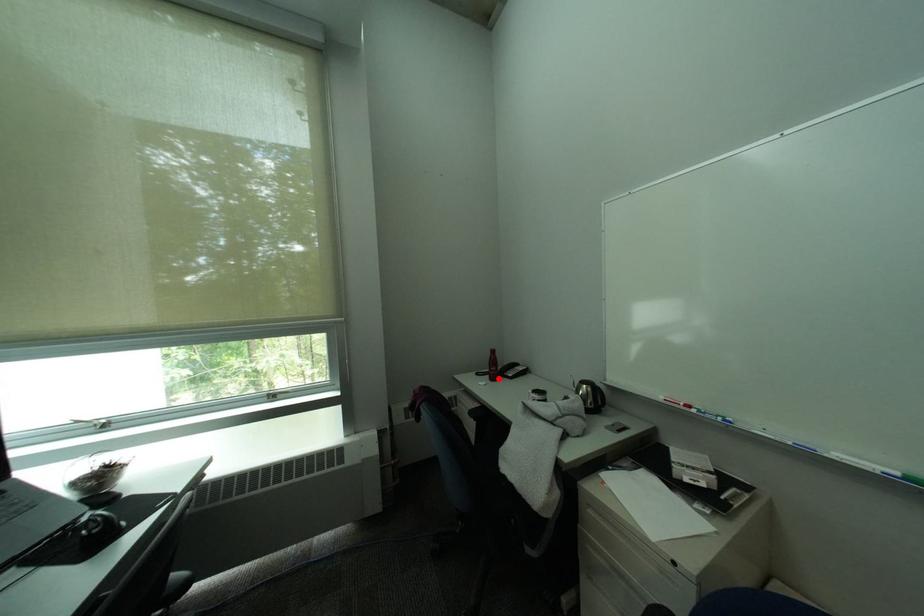
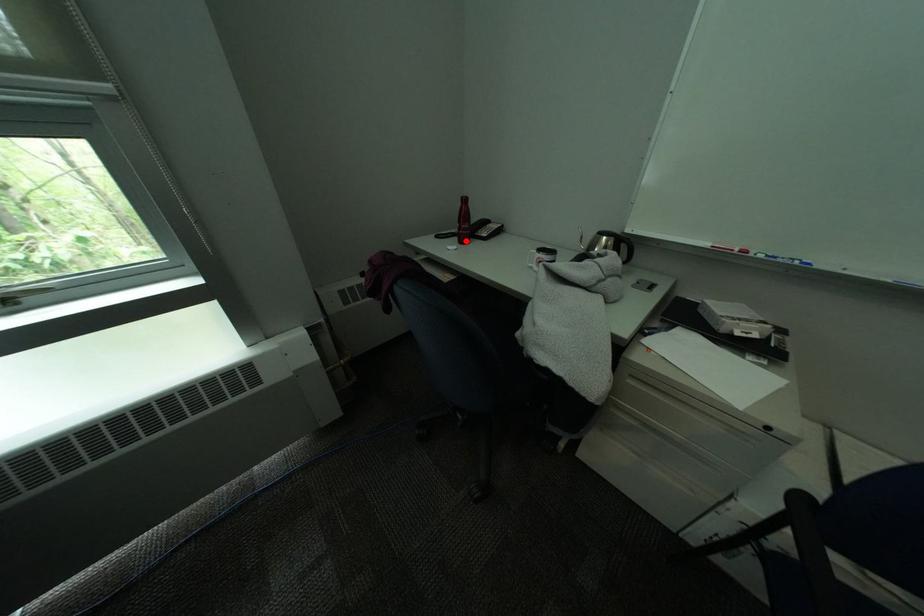
I am providing you with two images of the same scene from different viewpoints. A red point is marked on the first image and another point is marked on the second image. Are the points marked in image1 and image2 representing the same 3D position?

Yes